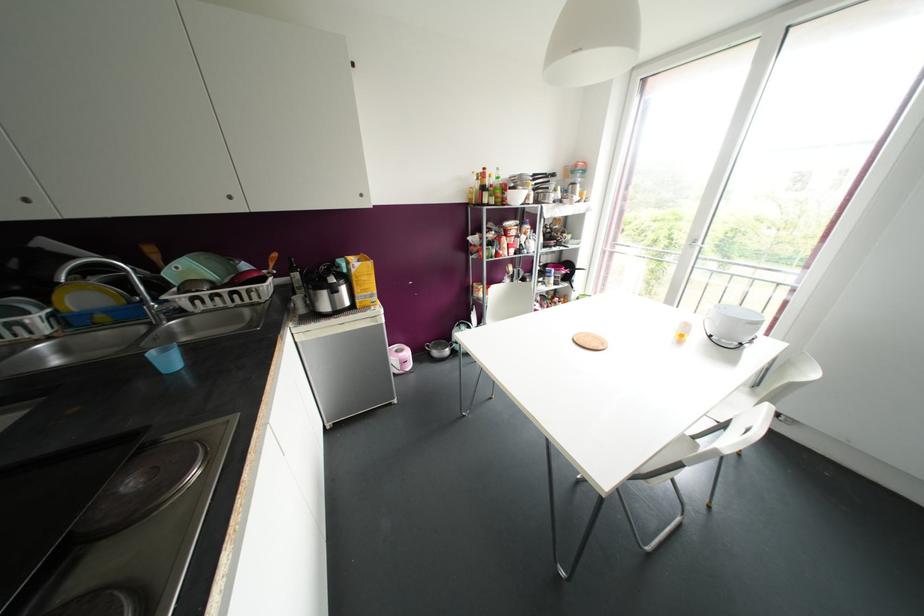
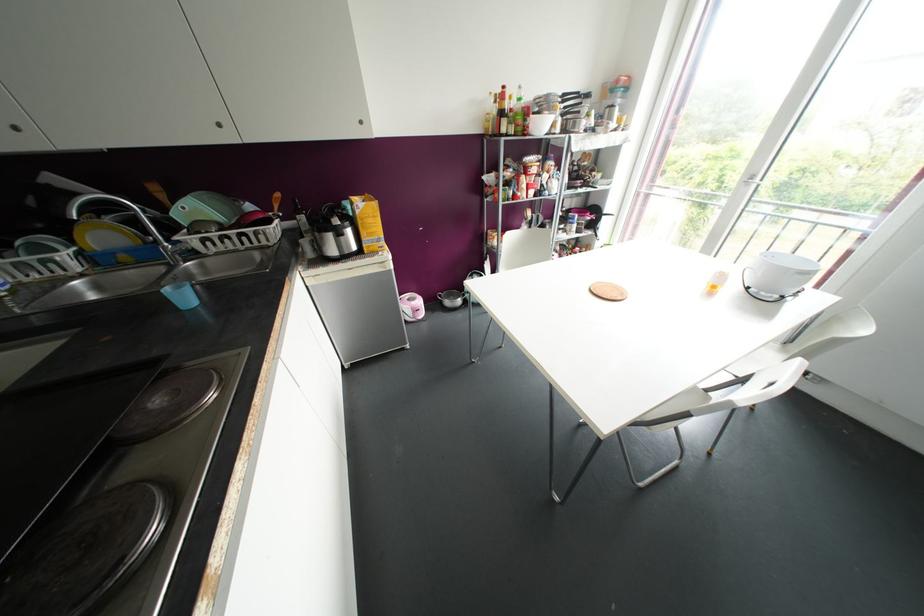
In the second image, find the point that corresponds to pixel 740 342 in the first image.

(782, 297)